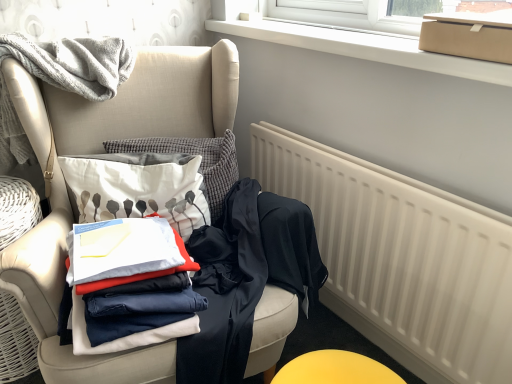
This screenshot has height=384, width=512. I want to click on white plastic window frame at upper center, so click(364, 48).

What is the approximate width of textured gray pillow at center?

textured gray pillow at center is 4.79 inches wide.

What do you see at coordinates (127, 285) in the screenshot? Image resolution: width=512 pixels, height=384 pixels. I see `white cotton shirt at center, placed as the first clothing when sorted from left to right` at bounding box center [127, 285].

You are a GUI agent. You are given a task and a screenshot of the screen. Output one action in this format:
    pyautogui.click(x=<x>, y=<y>)
    Task: Click on the matte beige armchair at left
    
    Given the screenshot: What is the action you would take?
    pyautogui.click(x=134, y=101)

At what (x,y) coordinates should I click in order to perform the action: click on white plastic window frame at upper center. Please return your answer as a coordinate pair (x, y). Looking at the image, I should click on (364, 48).

The height and width of the screenshot is (384, 512). I want to click on the 2nd clothing in front when counting from the white matte radiator at lower right, so point(127,285).

Is white cotton shirt at center, placed as the first clothing when sorted from left to right, taller than white matte radiator at lower right?

No, white cotton shirt at center, placed as the first clothing when sorted from left to right, is not taller than white matte radiator at lower right.

From the image's perspective, is white cotton shirt at center, placed as the first clothing when sorted from left to right, positioned above or below white matte radiator at lower right?

white cotton shirt at center, placed as the first clothing when sorted from left to right, is situated higher than white matte radiator at lower right in the image.

Considering the positions of objects textured gray pillow at center and white plastic window frame at upper center in the image provided, who is more to the right, textured gray pillow at center or white plastic window frame at upper center?

white plastic window frame at upper center is more to the right.

Is textured gray pillow at center wider or thinner than white plastic window frame at upper center?

Considering their sizes, textured gray pillow at center looks slimmer than white plastic window frame at upper center.

Who is more distant, textured gray pillow at center or white plastic window frame at upper center?

textured gray pillow at center is further away from the camera.

From the picture: Is textured gray pillow at center taller than white plastic window frame at upper center?

Indeed, textured gray pillow at center has a greater height compared to white plastic window frame at upper center.

Which point is more forward, (251, 219) or (306, 229)?

Point (306, 229)

Considering the sizes of objects dark blue fabric pants at center, acting as the 2th clothing starting from the left, and dark blue fabric at chair, which appears as the third clothing when viewed from the left, in the image provided, who is smaller, dark blue fabric pants at center, acting as the 2th clothing starting from the left, or dark blue fabric at chair, which appears as the third clothing when viewed from the left,?

dark blue fabric at chair, which appears as the third clothing when viewed from the left.

Between dark blue fabric pants at center, acting as the 2th clothing starting from the left, and dark blue fabric at chair, which appears as the third clothing when viewed from the left, which one has less height?

dark blue fabric at chair, which appears as the third clothing when viewed from the left.

From the image's perspective, who appears lower, dark blue fabric pants at center, acting as the 2th clothing starting from the left, or dark blue fabric at chair, which appears as the third clothing when viewed from the left?

dark blue fabric pants at center, acting as the 2th clothing starting from the left, appears lower in the image.

From the picture: From the image's perspective, is textured gray pillow at center located above dark blue fabric pants at center, acting as the 2th clothing starting from the left?

Yes.

Measure the distance between textured gray pillow at center and dark blue fabric pants at center, acting as the 2th clothing starting from the left.

They are 9.47 inches apart.

Is textured gray pillow at center next to dark blue fabric pants at center, placed as the 2th clothing when sorted from right to left, and touching it?

textured gray pillow at center and dark blue fabric pants at center, placed as the 2th clothing when sorted from right to left, are clearly separated.

Could you tell me if textured gray pillow at center is facing dark blue fabric pants at center, acting as the 2th clothing starting from the left?

No, textured gray pillow at center is not facing towards dark blue fabric pants at center, acting as the 2th clothing starting from the left.

From the image's perspective, which one is positioned higher, white plastic window frame at upper center or white cotton shirt at center, marked as the third clothing in a right-to-left arrangement?

From the image's view, white plastic window frame at upper center is above.

Considering the positions of objects white plastic window frame at upper center and white cotton shirt at center, marked as the third clothing in a right-to-left arrangement, in the image provided, who is more to the right, white plastic window frame at upper center or white cotton shirt at center, marked as the third clothing in a right-to-left arrangement,?

white plastic window frame at upper center is more to the right.

From the white plastic window frame at upper center, count 2nd clothings forward and point to it. Please provide its 2D coordinates.

[(127, 285)]

In terms of width, does white plastic window frame at upper center look wider or thinner when compared to white cotton shirt at center, placed as the first clothing when sorted from left to right?

In the image, white plastic window frame at upper center appears to be more narrow than white cotton shirt at center, placed as the first clothing when sorted from left to right.

Is white plastic window frame at upper center not inside textured gray pillow at center?

Absolutely, white plastic window frame at upper center is external to textured gray pillow at center.

Which of these two, white plastic window frame at upper center or textured gray pillow at center, is thinner?

With smaller width is textured gray pillow at center.

In the scene shown: Does white plastic window frame at upper center have a lesser height compared to textured gray pillow at center?

Answer: Indeed, white plastic window frame at upper center has a lesser height compared to textured gray pillow at center.

Which is more distant, (223, 31) or (177, 142)?

Positioned behind is point (223, 31).

Are textured gray pillow at center and dark blue fabric at chair, the first clothing when ordered from right to left, making contact?

No, textured gray pillow at center is not with dark blue fabric at chair, the first clothing when ordered from right to left.

Considering the sizes of objects textured gray pillow at center and dark blue fabric at chair, the first clothing when ordered from right to left, in the image provided, who is thinner, textured gray pillow at center or dark blue fabric at chair, the first clothing when ordered from right to left,?

Thinner between the two is textured gray pillow at center.

Can we say textured gray pillow at center lies outside dark blue fabric at chair, the first clothing when ordered from right to left?

Absolutely, textured gray pillow at center is external to dark blue fabric at chair, the first clothing when ordered from right to left.

From a real-world perspective, is textured gray pillow at center above or below dark blue fabric at chair, which appears as the third clothing when viewed from the left?

Clearly, from a real-world perspective, textured gray pillow at center is above dark blue fabric at chair, which appears as the third clothing when viewed from the left.

What are the coordinates of `clothing that is the 3rd one when counting leftward from the white matte radiator at lower right` in the screenshot? It's located at (127, 285).

This screenshot has height=384, width=512. In order to click on window frame lying above the textured gray pillow at center (from the image's perspective) in this screenshot , I will do `click(364, 48)`.

Based on their spatial positions, is dark blue fabric pants at center, placed as the 2th clothing when sorted from right to left, or dark blue fabric at chair, which appears as the third clothing when viewed from the left, further from matte beige armchair at left?

Among the two, dark blue fabric at chair, which appears as the third clothing when viewed from the left, is located further to matte beige armchair at left.

Based on their spatial positions, is dark blue fabric at chair, the first clothing when ordered from right to left, or white plastic window frame at upper center closer to dark blue fabric pants at center, placed as the 2th clothing when sorted from right to left?

Among the two, dark blue fabric at chair, the first clothing when ordered from right to left, is located nearer to dark blue fabric pants at center, placed as the 2th clothing when sorted from right to left.

Estimate the real-world distances between objects in this image. Which object is closer to white cotton pillow at center, textured gray pillow at center or white cotton shirt at center, marked as the third clothing in a right-to-left arrangement?

The object closer to white cotton pillow at center is textured gray pillow at center.

Which object lies nearer to the anchor point white cotton shirt at center, marked as the third clothing in a right-to-left arrangement, textured gray pillow at center or dark blue fabric at chair, the first clothing when ordered from right to left?

dark blue fabric at chair, the first clothing when ordered from right to left, is positioned closer to the anchor white cotton shirt at center, marked as the third clothing in a right-to-left arrangement.

Estimate the real-world distances between objects in this image. Which object is closer to white plastic window frame at upper center, matte beige armchair at left or white matte radiator at lower right?

Based on the image, white matte radiator at lower right appears to be nearer to white plastic window frame at upper center.

Looking at the image, which one is located further to white matte radiator at lower right, dark blue fabric pants at center, placed as the 2th clothing when sorted from right to left, or dark blue fabric at chair, the first clothing when ordered from right to left?

dark blue fabric pants at center, placed as the 2th clothing when sorted from right to left, is positioned further to the anchor white matte radiator at lower right.

Looking at the image, which one is located closer to white cotton shirt at center, marked as the third clothing in a right-to-left arrangement, matte cardboard box at upper right or textured gray pillow at center?

textured gray pillow at center lies closer to white cotton shirt at center, marked as the third clothing in a right-to-left arrangement, than the other object.

Estimate the real-world distances between objects in this image. Which object is closer to white cotton pillow at center, textured gray pillow at center or dark blue fabric pants at center, placed as the 2th clothing when sorted from right to left?

Based on the image, textured gray pillow at center appears to be nearer to white cotton pillow at center.

Image resolution: width=512 pixels, height=384 pixels. Identify the location of pillow between white plastic window frame at upper center and white matte radiator at lower right from top to bottom. (194, 154).

Image resolution: width=512 pixels, height=384 pixels. Find the location of `chair between white plastic window frame at upper center and white matte radiator at lower right in the vertical direction`. chair between white plastic window frame at upper center and white matte radiator at lower right in the vertical direction is located at coordinates (134, 101).

The width and height of the screenshot is (512, 384). In order to click on pillow located between white cotton pillow at center and white matte radiator at lower right in the left-right direction in this screenshot , I will do `click(194, 154)`.

Locate an element on the screen. pillow between white plastic window frame at upper center and white cotton shirt at center, marked as the third clothing in a right-to-left arrangement, in the vertical direction is located at coordinates (x=194, y=154).